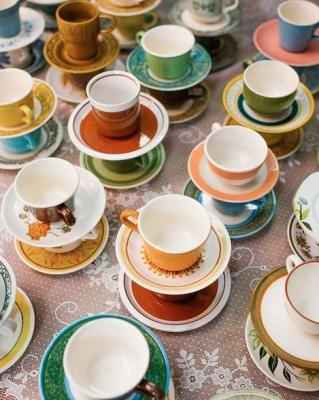
This screenshot has height=400, width=319. I want to click on blue cups and mugs, so pos(294,35), pos(7,27), pos(19,145), pos(225,205).